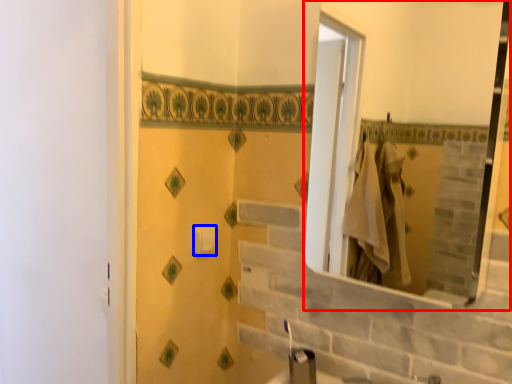
Question: Which point is further to the camera, mirror (highlighted by a red box) or toilet paper (highlighted by a blue box)?

Choices:
 (A) mirror
 (B) toilet paper

Answer: (B)